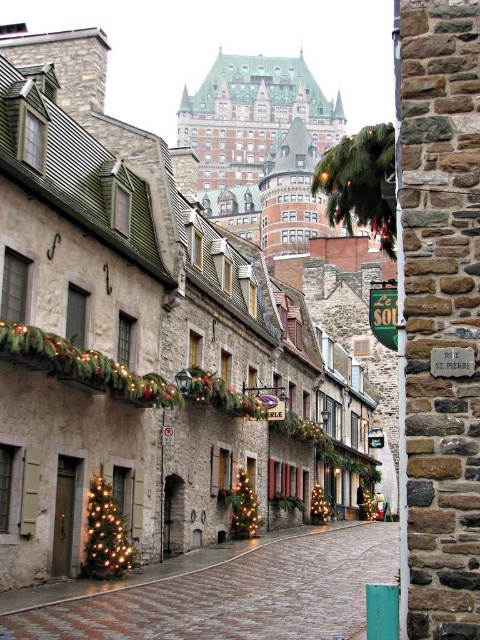
Question: Which object appears farthest from the camera in this image?

Choices:
 (A) iridescent glass christmas tree at lower left
 (B) brick paved alley at center

Answer: (A)

Question: Which of these objects is positioned farthest from the stone building at center?

Choices:
 (A) iridescent glass christmas tree at lower left
 (B) brick paved alley at center

Answer: (B)

Question: Considering the relative positions of brick paved alley at center and iridescent glass christmas tree at lower left in the image provided, where is brick paved alley at center located with respect to iridescent glass christmas tree at lower left?

Choices:
 (A) right
 (B) left

Answer: (A)

Question: Which point is closer to the camera?

Choices:
 (A) (110, 540)
 (B) (206, 420)
 (C) (199, 595)

Answer: (C)

Question: Is stone building at center to the right of iridescent glass christmas tree at lower left from the viewer's perspective?

Choices:
 (A) yes
 (B) no

Answer: (A)

Question: Does stone building at center come behind iridescent glass christmas tree at lower left?

Choices:
 (A) no
 (B) yes

Answer: (A)